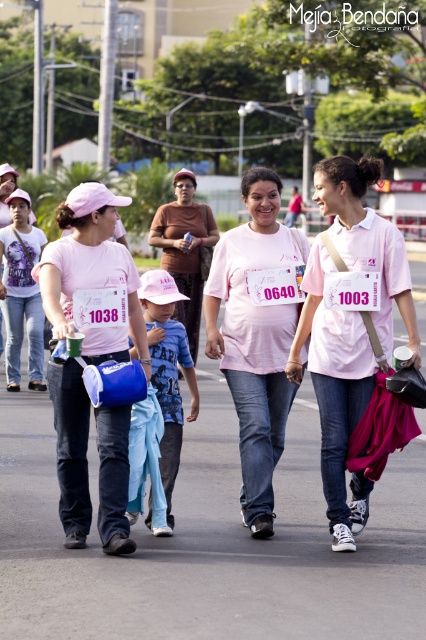
Which is more to the right, pink matte t-shirt at center or brown matte shirt at center?

From the viewer's perspective, pink matte t-shirt at center appears more on the right side.

Where is `pink matte t-shirt at center`? The width and height of the screenshot is (426, 640). pink matte t-shirt at center is located at coordinates (255, 339).

Find the location of a particular element. pink matte t-shirt at center is located at coordinates (255, 339).

Does point (108, 259) come behind point (201, 275)?

No, it is not.

Is point (124, 262) farther from viewer compared to point (154, 237)?

No, it is in front of (154, 237).

Where is `matte pink t-shirt at center`? The height and width of the screenshot is (640, 426). matte pink t-shirt at center is located at coordinates (92, 278).

Between pink matte t-shirt at center and blue denim jeans at center, which one is positioned lower?

blue denim jeans at center is lower down.

Can you confirm if pink matte t-shirt at center is positioned below blue denim jeans at center?

No.

Which is in front, point (264, 230) or point (180, 360)?

Point (180, 360) is in front.

You are a GUI agent. You are given a task and a screenshot of the screen. Output one action in this format:
    pyautogui.click(x=<x>, y=<y>)
    Task: Click on the pink matte t-shirt at center
    This screenshot has height=640, width=426.
    Given the screenshot: What is the action you would take?
    pyautogui.click(x=255, y=339)